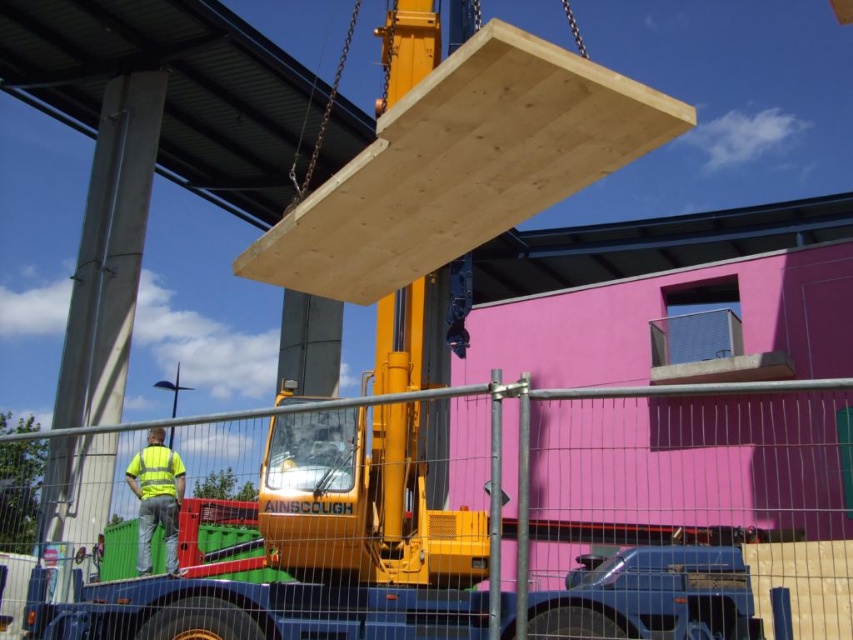
Question: Which object is closer to the camera taking this photo?

Choices:
 (A) yellow reflective safety vest at lower left
 (B) yellow reflective vest at lower left

Answer: (B)

Question: Does yellow reflective vest at lower left have a lesser width compared to yellow reflective safety vest at lower left?

Choices:
 (A) no
 (B) yes

Answer: (A)

Question: Which of the following is the closest to the observer?

Choices:
 (A) yellow reflective vest at lower left
 (B) yellow reflective safety vest at lower left

Answer: (A)

Question: Is yellow reflective vest at lower left thinner than yellow reflective safety vest at lower left?

Choices:
 (A) no
 (B) yes

Answer: (A)

Question: Can you confirm if yellow reflective vest at lower left is positioned to the left of yellow reflective safety vest at lower left?

Choices:
 (A) no
 (B) yes

Answer: (B)